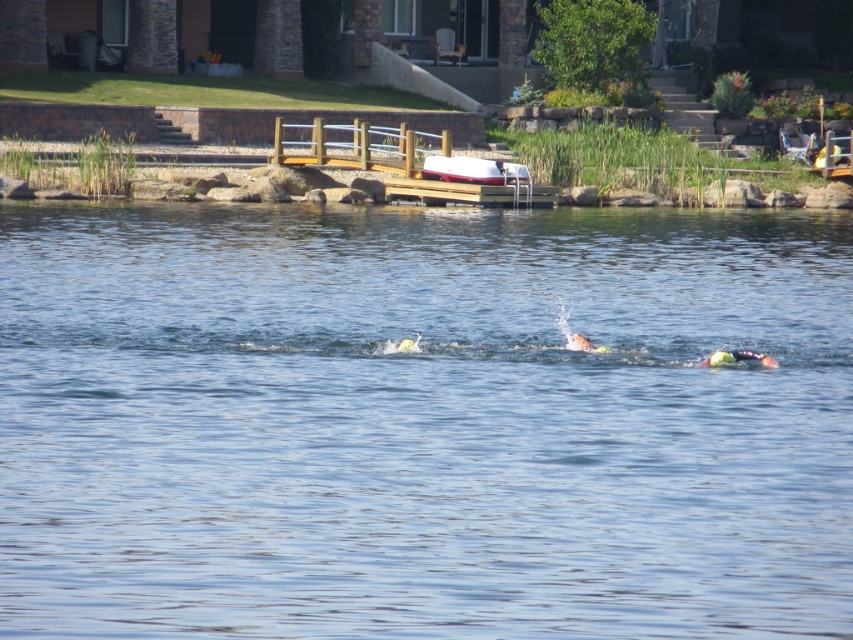
Question: Among these points, which one is farthest from the camera?

Choices:
 (A) (432, 179)
 (B) (339, 401)
 (C) (723, 358)

Answer: (A)

Question: Which point is farther to the camera?

Choices:
 (A) (459, 173)
 (B) (39, 579)
 (C) (724, 355)

Answer: (A)

Question: Does clear blue water at center have a larger size compared to white matte boat at center?

Choices:
 (A) yes
 (B) no

Answer: (A)

Question: Is clear blue water at center to the left of white matte boat at center from the viewer's perspective?

Choices:
 (A) no
 (B) yes

Answer: (B)

Question: Does white matte boat at center appear on the right side of yellow-green swim cap at right?

Choices:
 (A) no
 (B) yes

Answer: (A)

Question: Which of these objects is positioned closest to the white matte boat at center?

Choices:
 (A) clear blue water at center
 (B) yellow-green swim cap at right

Answer: (A)